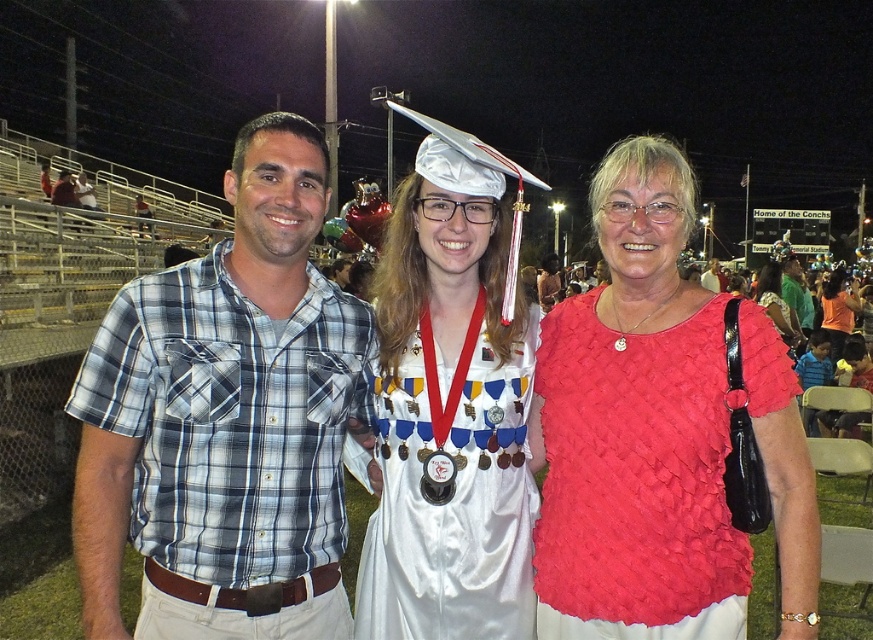
Is plaid shirt at center thinner than orange fabric dress at center?

Correct, plaid shirt at center's width is less than orange fabric dress at center's.

Describe the element at coordinates (225, 419) in the screenshot. I see `plaid shirt at center` at that location.

Who is more distant from viewer, (217, 426) or (829, 308)?

The point (829, 308) is behind.

Where is `plaid shirt at center`? The width and height of the screenshot is (873, 640). plaid shirt at center is located at coordinates (225, 419).

Is red woven blouse at center smaller than white satin gown at center?

Yes.

Does red woven blouse at center appear over white satin gown at center?

Indeed, red woven blouse at center is positioned over white satin gown at center.

Between point (631, 186) and point (361, 580), which one is positioned in front?

Point (631, 186) is more forward.

Locate an element on the screen. The width and height of the screenshot is (873, 640). red woven blouse at center is located at coordinates (658, 433).

Who is more forward, (212, 448) or (404, 404)?

Point (212, 448) is in front.

Which is behind, point (338, 468) or point (465, 333)?

Point (465, 333)

Image resolution: width=873 pixels, height=640 pixels. I want to click on plaid shirt at center, so click(225, 419).